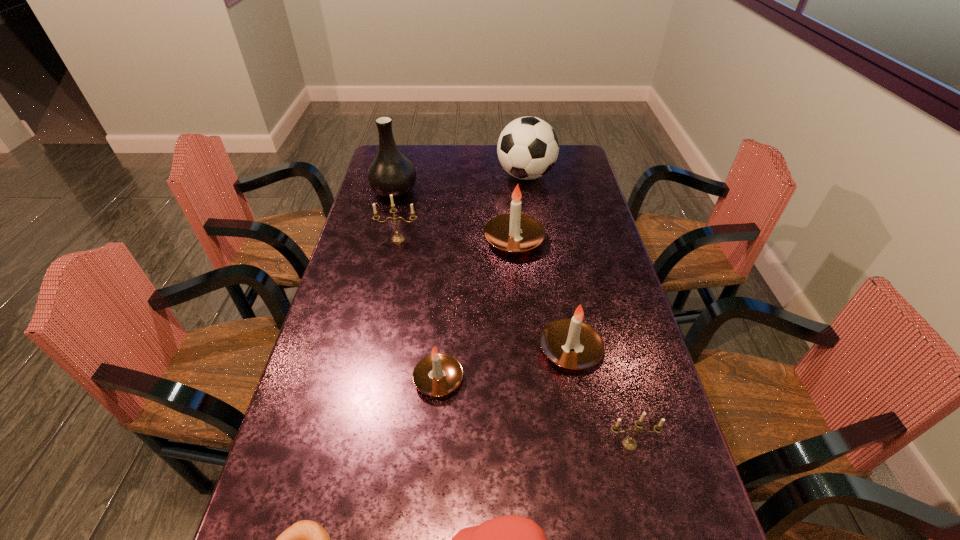
Find the location of `the tallest object`. the tallest object is located at coordinates (390, 172).

Locate an element on the screen. The height and width of the screenshot is (540, 960). black soccer ball is located at coordinates (528, 147).

Where is `the tallest candle`? This screenshot has height=540, width=960. the tallest candle is located at coordinates (514, 233).

The height and width of the screenshot is (540, 960). Find the location of `the farthest white candle`. the farthest white candle is located at coordinates (514, 233).

The width and height of the screenshot is (960, 540). Find the location of `the second biggest white candle`. the second biggest white candle is located at coordinates (570, 343).

Find the location of a particular element. This screenshot has width=960, height=540. the farther metallic candle is located at coordinates (397, 238).

Locate an element on the screen. This screenshot has width=960, height=540. the bigger metallic candle is located at coordinates (397, 238).

Image resolution: width=960 pixels, height=540 pixels. I want to click on the leftmost white candle, so click(x=438, y=374).

Locate an element on the screen. This screenshot has height=540, width=960. the smallest white candle is located at coordinates (438, 374).

At what (x,y) coordinates should I click in order to perform the action: click on the third nearest object. Please return your answer as a coordinate pair (x, y). This screenshot has height=540, width=960. Looking at the image, I should click on (629, 443).